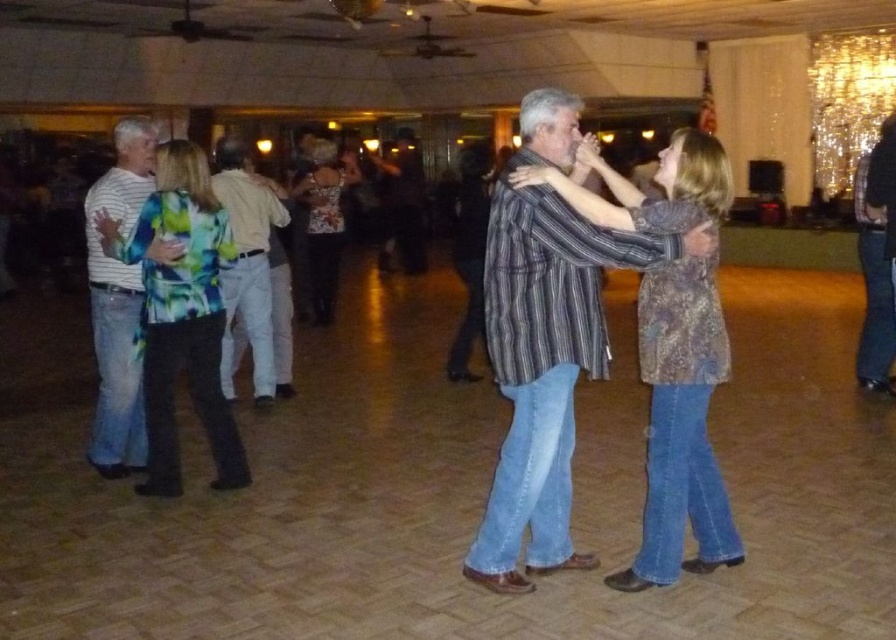
Question: Which point is farther to the camera?

Choices:
 (A) [233, 253]
 (B) [392, 198]
 (C) [317, 166]
 (D) [261, 236]

Answer: (B)

Question: Which point is closer to the camera?

Choices:
 (A) (177, 152)
 (B) (116, 131)
 (C) (322, 282)

Answer: (A)

Question: Is floral fabric blouse at left below printed silk blouse at center?

Choices:
 (A) no
 (B) yes

Answer: (B)

Question: From the image, what is the correct spatial relationship of striped cotton shirt at left in relation to printed silk blouse at center?

Choices:
 (A) right
 (B) left

Answer: (B)

Question: Is light brown cotton shirt at center closer to camera compared to printed silk blouse at center?

Choices:
 (A) yes
 (B) no

Answer: (A)

Question: Estimate the real-world distances between objects in this image. Which object is closer to the striped cotton shirt at center?

Choices:
 (A) dark brown leather jacket at center
 (B) light brown cotton shirt at center
 (C) printed silk blouse at center
 (D) striped cotton shirt at left

Answer: (D)